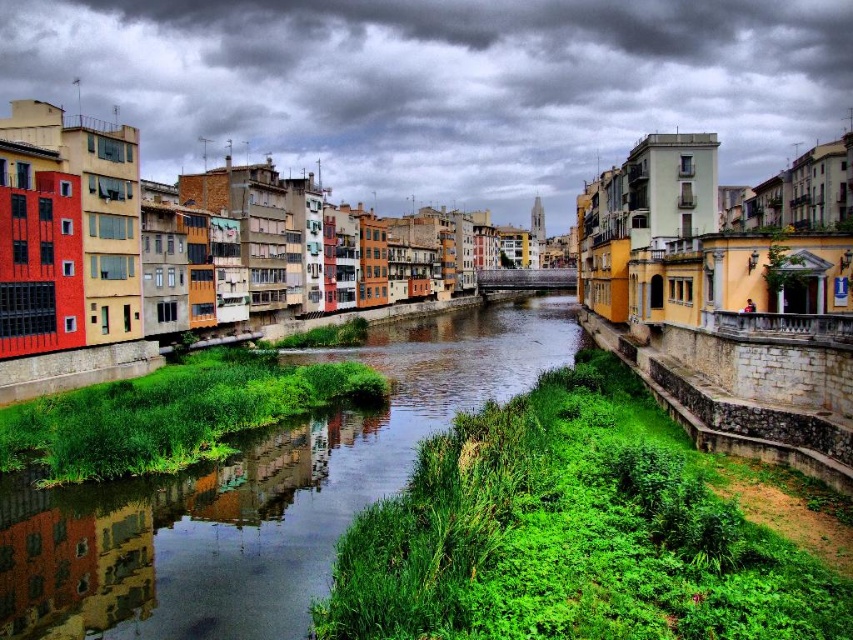
Question: Is cloudy sky at upper center to the left of green grassy bank at center from the viewer's perspective?

Choices:
 (A) yes
 (B) no

Answer: (B)

Question: Can you confirm if cloudy sky at upper center is positioned to the left of green grassy bank at center?

Choices:
 (A) no
 (B) yes

Answer: (A)

Question: Which point is farther to the camera?

Choices:
 (A) (183, 168)
 (B) (138, 573)

Answer: (A)

Question: Does cloudy sky at upper center have a smaller size compared to green grassy bank at center?

Choices:
 (A) yes
 (B) no

Answer: (B)

Question: Which object is closer to the camera taking this photo?

Choices:
 (A) cloudy sky at upper center
 (B) green grassy bank at center

Answer: (B)